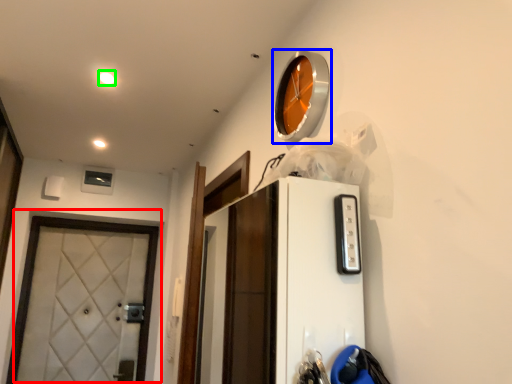
Question: Which object is positioned farthest from door (highlighted by a red box)? Select from clock (highlighted by a blue box) and light (highlighted by a green box).

Choices:
 (A) clock
 (B) light

Answer: (A)